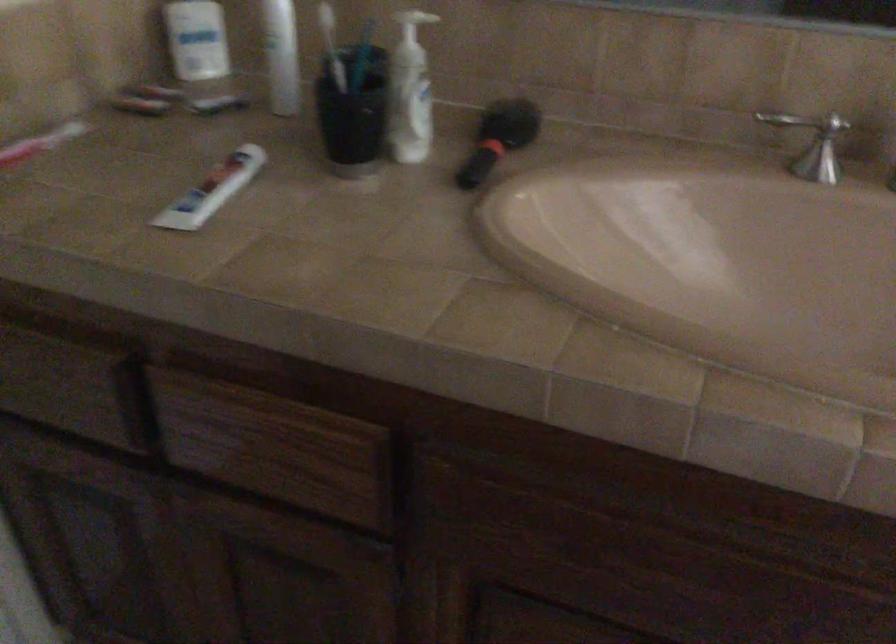
Image resolution: width=896 pixels, height=644 pixels. Identify the location of toothbrush in holder. (331, 44).